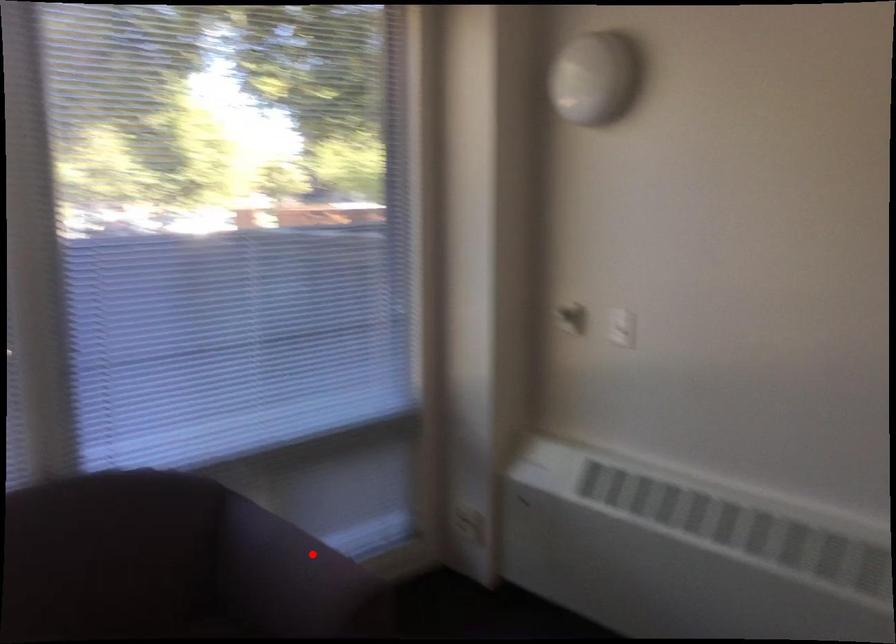
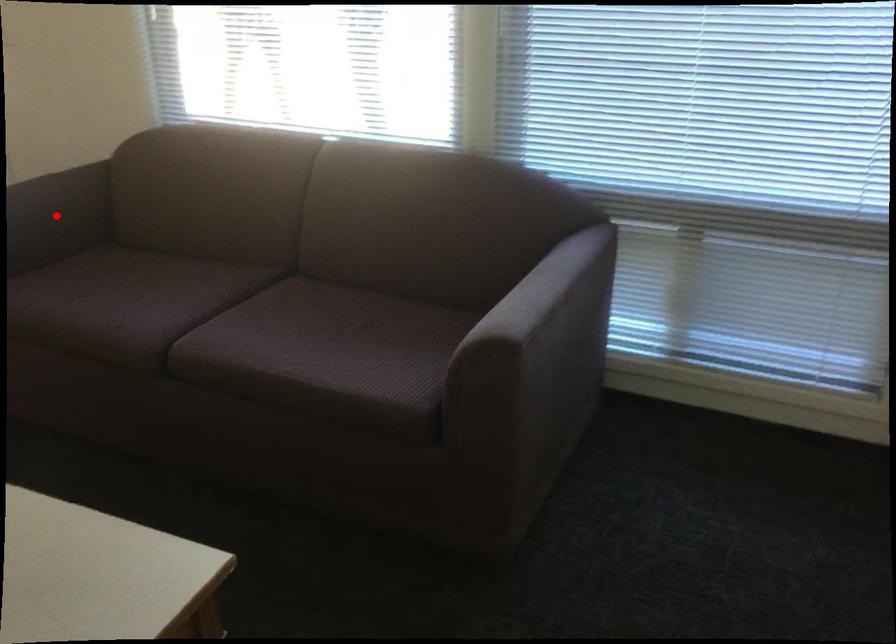
I am providing you with two images of the same scene from different viewpoints. A red point is marked on the first image and another point is marked on the second image. Is the marked point in image1 the same physical position as the marked point in image2?

No